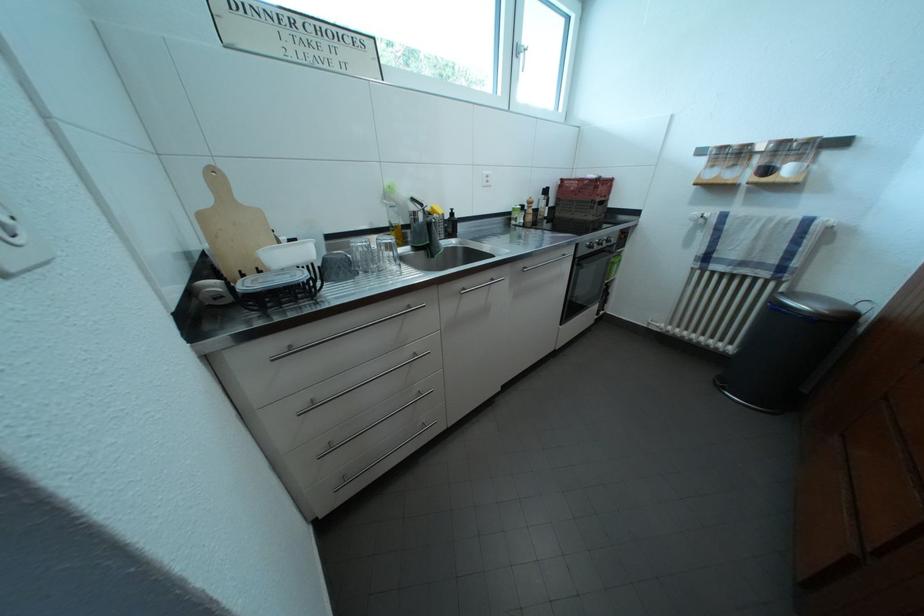
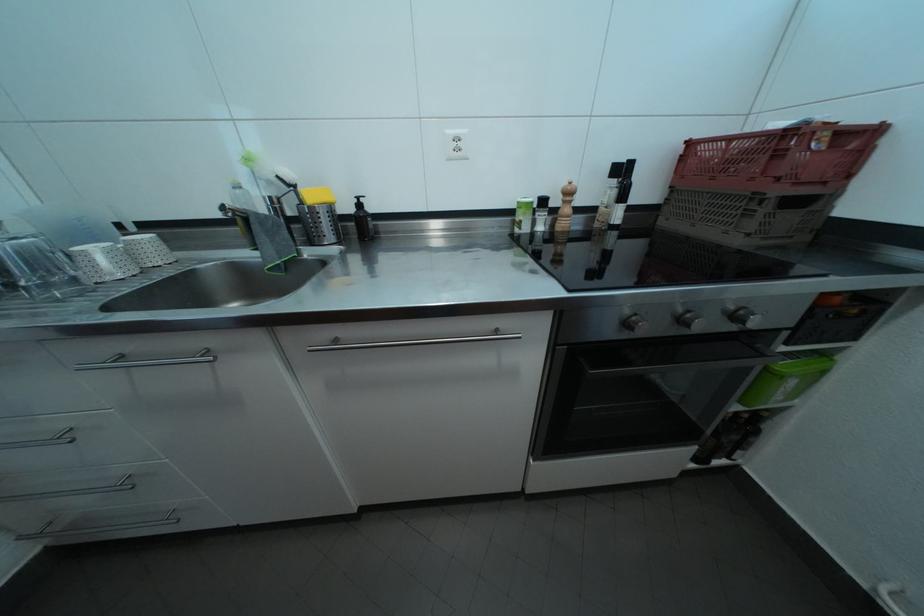
Where in the second image is the point corresponding to the point at 616,246 from the first image?

(745, 323)